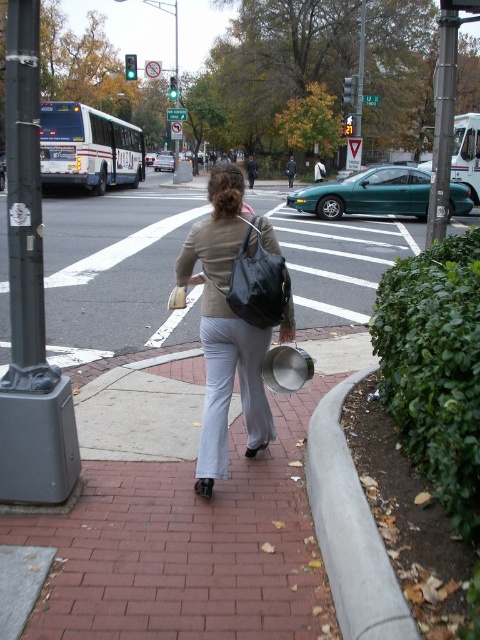
Question: Does matte black backpack at center appear under metallic pole at center-right?

Choices:
 (A) yes
 (B) no

Answer: (A)

Question: Which point appears farthest from the camera in this image?

Choices:
 (A) (440, 116)
 (B) (272, 230)

Answer: (A)

Question: Which object is positioned closest to the gray concrete curb at lower right?

Choices:
 (A) matte black backpack at center
 (B) metallic pole at center-right
 (C) brick pavement at center

Answer: (A)

Question: Is matte black backpack at center to the left of metallic pole at center-right from the viewer's perspective?

Choices:
 (A) no
 (B) yes

Answer: (B)

Question: Can you confirm if matte black backpack at center is thinner than metallic pole at center-right?

Choices:
 (A) yes
 (B) no

Answer: (A)

Question: Which object appears farthest from the camera in this image?

Choices:
 (A) brick pavement at center
 (B) metallic pole at center-right
 (C) matte black backpack at center

Answer: (A)